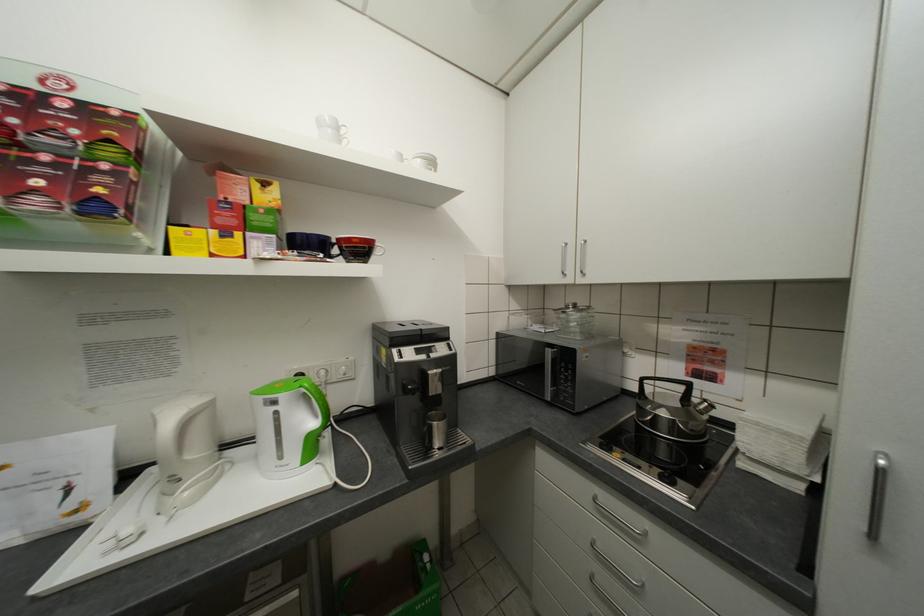
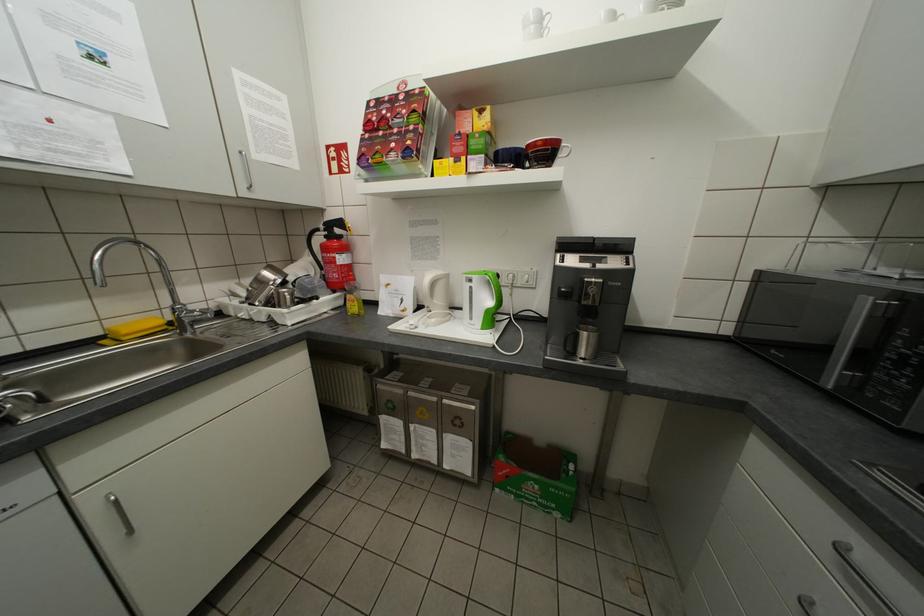
Where in the second image is the point corresponding to [338,130] from the first image?

(541, 28)